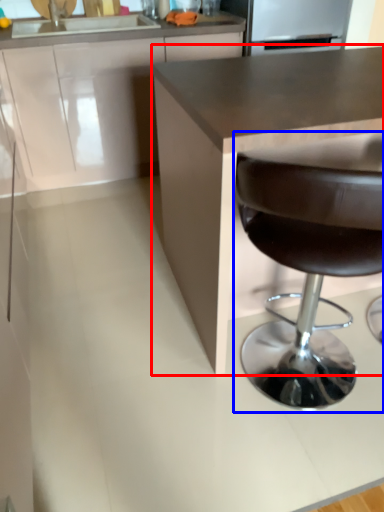
Question: Which of the following is the farthest to the observer, countertop (highlighted by a red box) or chair (highlighted by a blue box)?

Choices:
 (A) countertop
 (B) chair

Answer: (A)